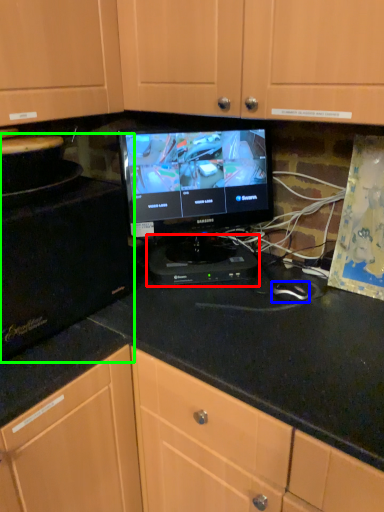
Question: Based on their relative distances, which object is nearer to appliance (highlighted by a red box)? Choose from mouse (highlighted by a blue box) and appliance (highlighted by a green box).

Choices:
 (A) mouse
 (B) appliance

Answer: (A)